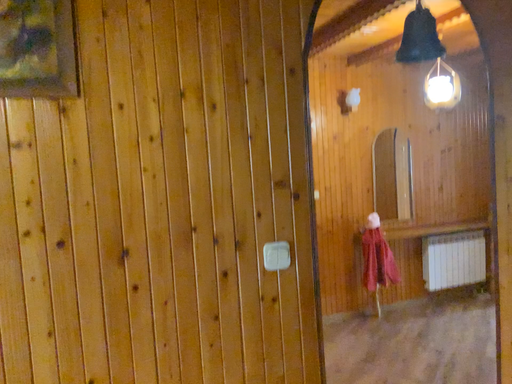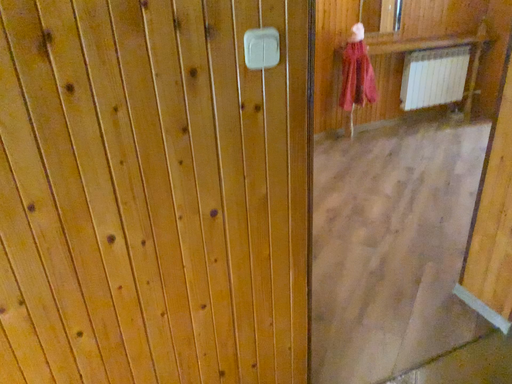
Question: How did the camera likely rotate when shooting the video?

Choices:
 (A) rotated upward
 (B) rotated downward

Answer: (B)